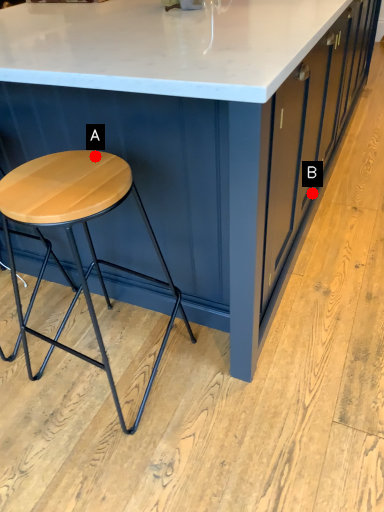
Question: Two points are circled on the image, labeled by A and B beside each circle. Which point is closer to the camera taking this photo?

Choices:
 (A) A is closer
 (B) B is closer

Answer: (A)